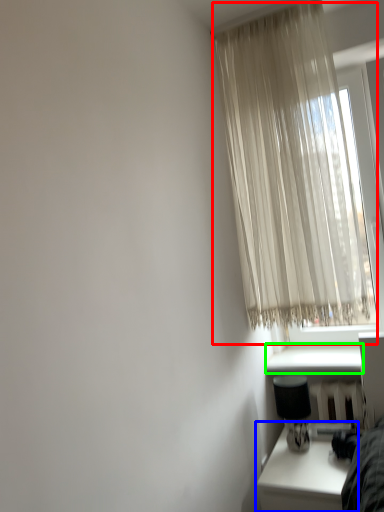
Question: Considering the real-world distances, which object is closest to curtain (highlighted by a red box)? table (highlighted by a blue box) or window sill (highlighted by a green box).

Choices:
 (A) table
 (B) window sill

Answer: (B)